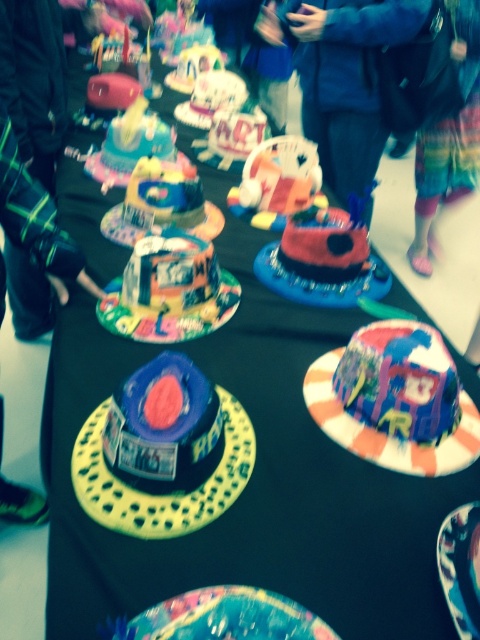
Between blue matte hat at center and matte pink hat at center, which one appears on the left side from the viewer's perspective?

blue matte hat at center

Which is more to the right, blue matte hat at center or matte pink hat at center?

From the viewer's perspective, matte pink hat at center appears more on the right side.

Which is in front, point (103, 429) or point (276, 253)?

Point (103, 429) is in front.

What are the coordinates of `blue matte hat at center` in the screenshot? It's located at (164, 428).

Looking at this image, who is shorter, matte pink cake at center or matte pink hat at center?

matte pink hat at center is shorter.

You are a GUI agent. You are given a task and a screenshot of the screen. Output one action in this format:
    pyautogui.click(x=<x>, y=<y>)
    Task: Click on the matte pink cake at center
    The height and width of the screenshot is (640, 480).
    Given the screenshot: What is the action you would take?
    pyautogui.click(x=324, y=244)

Who is more forward, (177, 358) or (128, 278)?

Point (177, 358) is more forward.

Is blue matte hat at center bigger than shiny metallic cake at center?

No, blue matte hat at center is not bigger than shiny metallic cake at center.

The width and height of the screenshot is (480, 640). What are the coordinates of `blue matte hat at center` in the screenshot? It's located at (164, 428).